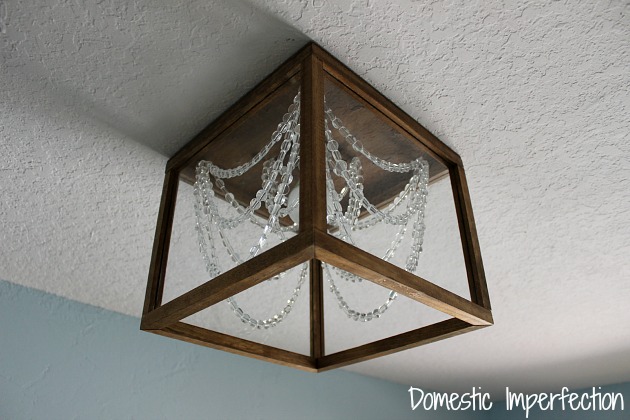
Locate an element on the screen. The height and width of the screenshot is (420, 630). wooden frame around chandelier is located at coordinates (312, 85).